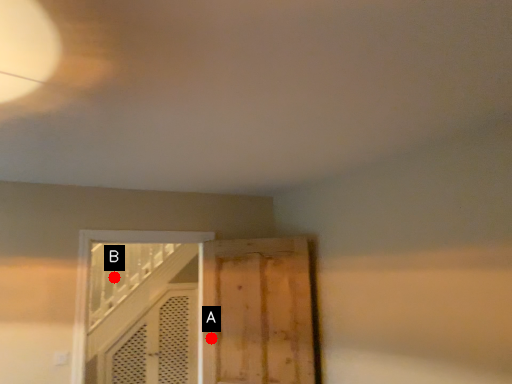
Question: Two points are circled on the image, labeled by A and B beside each circle. Which of the following is the closest to the observer?

Choices:
 (A) A is closer
 (B) B is closer

Answer: (A)